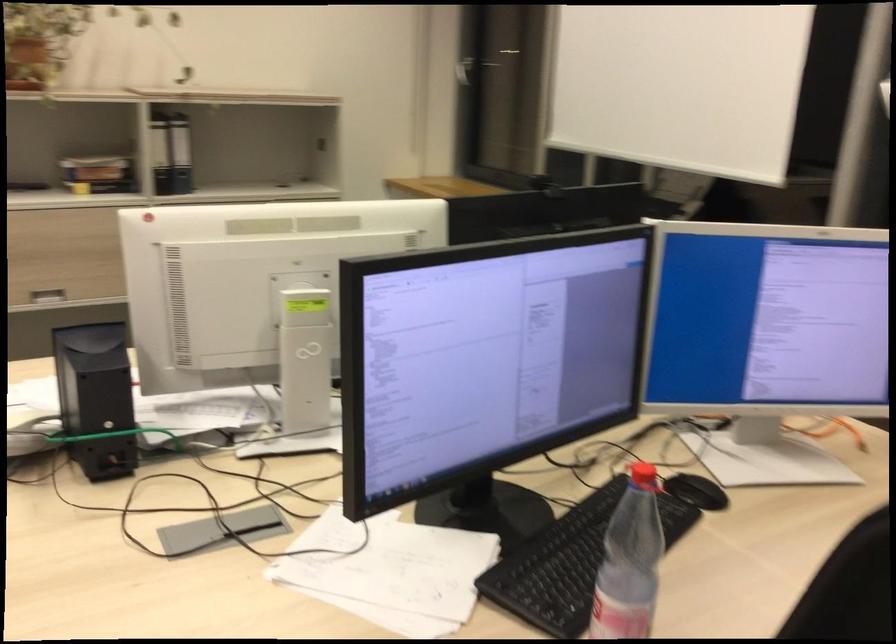
The width and height of the screenshot is (896, 644). What do you see at coordinates (470, 69) in the screenshot?
I see `a silver cabinet handle` at bounding box center [470, 69].